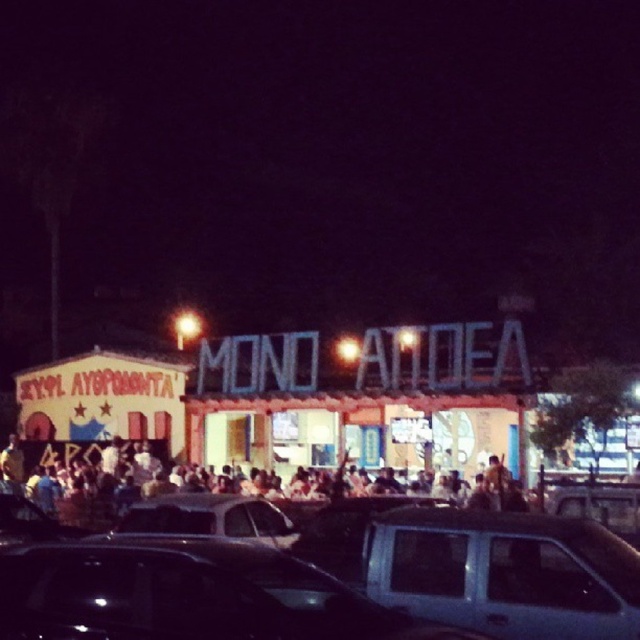
In order to click on metallic silver car at center in this screenshot , I will do `click(186, 595)`.

Between metallic silver car at center and metallic gray sedan at lower right, which one has more height?

Standing taller between the two is metallic gray sedan at lower right.

Identify the location of metallic silver car at center. Image resolution: width=640 pixels, height=640 pixels. (186, 595).

I want to click on metallic silver car at center, so [186, 595].

Between metallic silver car at center and shiny silver sedan at center, which one has more height?

Standing taller between the two is shiny silver sedan at center.

Who is lower down, metallic silver car at center or shiny silver sedan at center?

shiny silver sedan at center is below.

You are a GUI agent. You are given a task and a screenshot of the screen. Output one action in this format:
    pyautogui.click(x=<x>, y=<y>)
    Task: Click on the metallic silver car at center
    The image size is (640, 640).
    Given the screenshot: What is the action you would take?
    pyautogui.click(x=186, y=595)

Who is positioned more to the right, metallic silver car at center or multicolored fabric crowd at center?

metallic silver car at center is more to the right.

This screenshot has height=640, width=640. What do you see at coordinates (186, 595) in the screenshot?
I see `metallic silver car at center` at bounding box center [186, 595].

I want to click on metallic silver car at center, so click(186, 595).